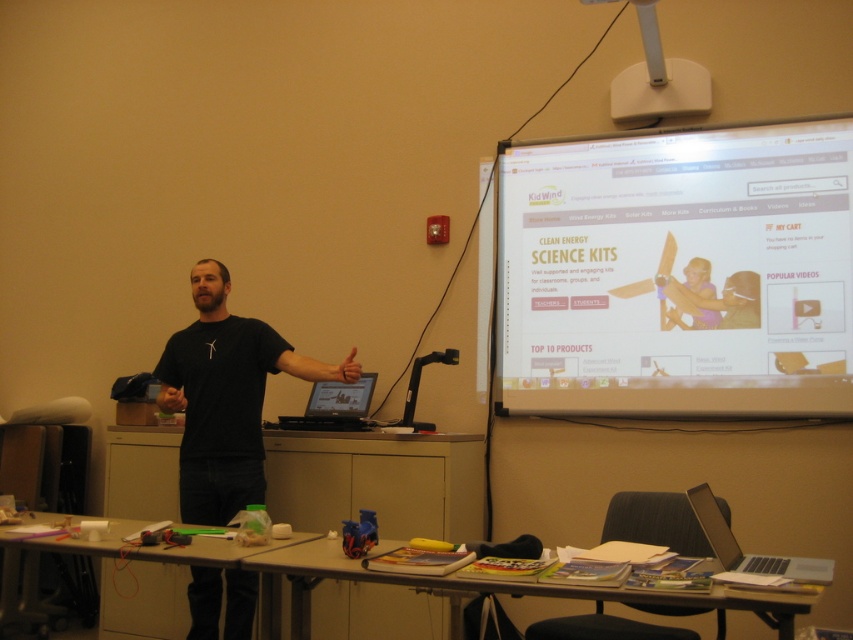
You are sitting in the classroom and want to know which of the two points, point (x=219, y=470) or point (x=326, y=406), is closer to you. Can you determine this based on the scene?

Point (x=219, y=470) is closer to the viewer than point (x=326, y=406).

You are a student sitting in the classroom and want to borrow the matte black laptop at center. The black matte shirt at center belongs to the presenter. Can you reach the laptop without moving closer than 18 inches from the presenter?

The distance between the black matte shirt at center and the matte black laptop at center is 18.69 inches. Since 18.69 inches is slightly more than 18 inches, you cannot reach the laptop without moving closer than 18 inches from the presenter.

Consider the image. You are a student sitting in the classroom and want to describe the items at the center of the room. Which object is positioned to the left of the other between the black matte shirt at center and the matte black laptop at center?

The black matte shirt at center is positioned to the left of the matte black laptop at center.